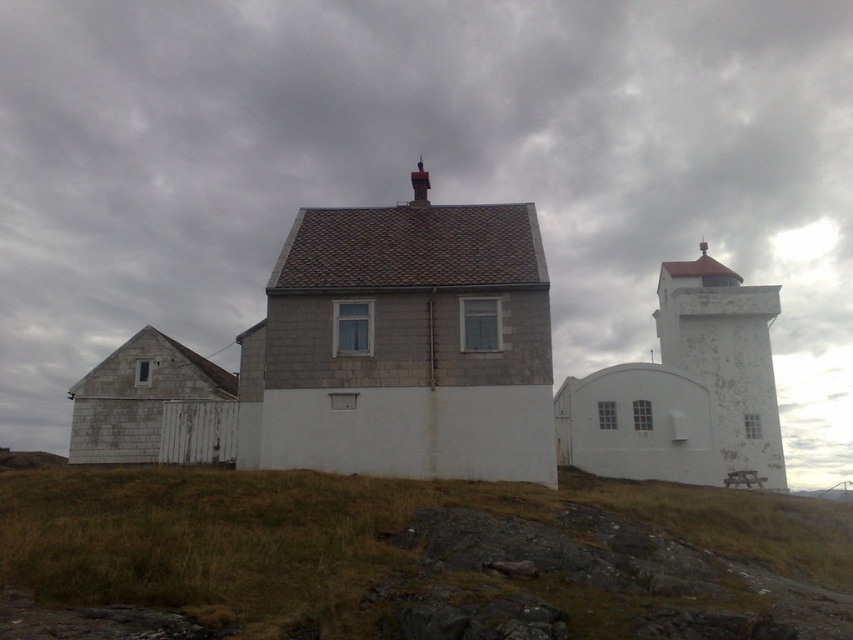
You are standing on the green grass at center and want to walk to the white stone house at center. Is the house behind or in front of you?

The white stone house at center is behind you because the green grass at center is closer to the viewer than the white stone house at center.

You are a drone operator trying to land a drone on the green grass at center. The drone has a GPS coordinate system where the bottom left corner of the image is the origin point. The coordinates are given as a pair of values between 0 and 1. The first value is the horizontal axis, and the second is the vertical axis. According to the scene, where should you direct the drone to land?

The green grass at center is located at coordinate point (416, 557), so you should direct the drone to land there.